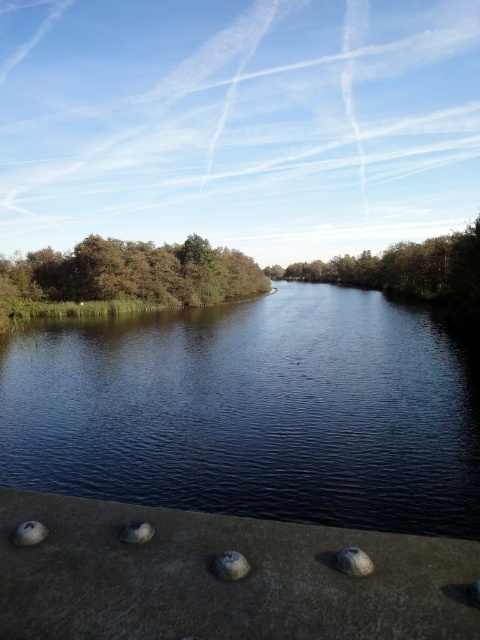
You are standing on the gray matte stone at lower left and want to reach the dark blue water at center. Which direction should you move to get there?

You should move to the right because the dark blue water at center is to the left of gray matte stone at lower left, so moving right from the gray matte stone at lower left will lead you towards the dark blue water at center.

From the picture: You are a drone operator trying to capture a photo of the dark blue water at center. The drone is currently at point 0.644, 0.527. Is the drone positioned correctly to take the photo?

Yes, the dark blue water at center is located at point (252, 412), so the drone is correctly positioned to take the photo.